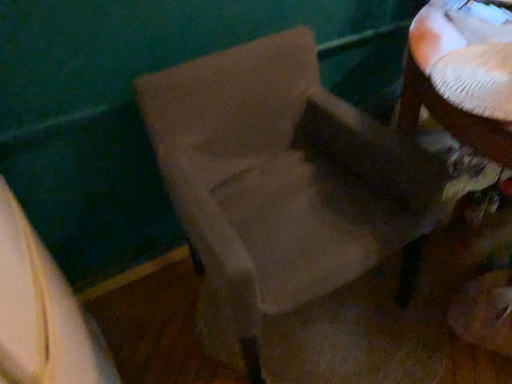
Locate an element on the screen. Image resolution: width=512 pixels, height=384 pixels. free space that is in between suede-like beige chair at center and white fabric at lower left is located at coordinates (170, 331).